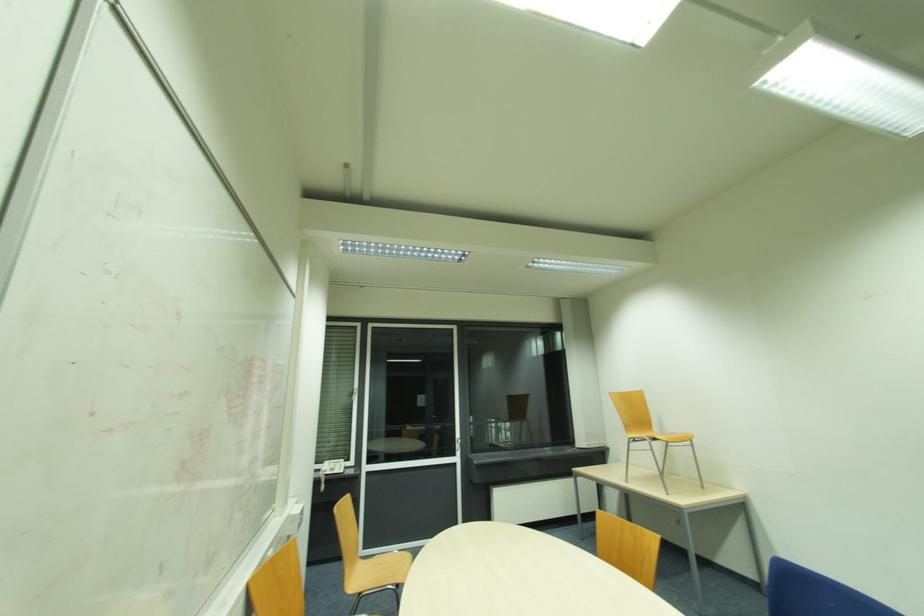
Which object does [332,467] point to?

This point indicates the telephone.